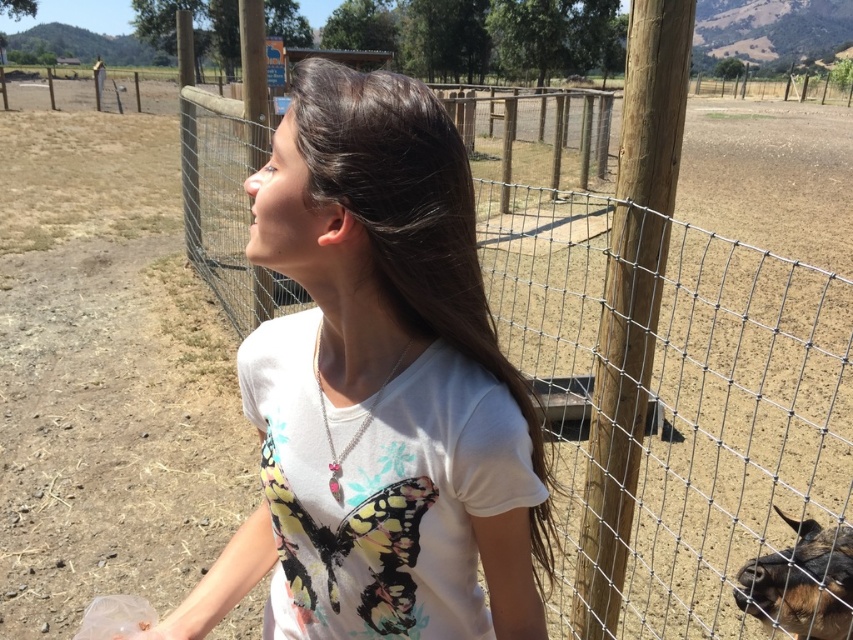
Who is more distant from viewer, (349, 544) or (802, 554)?

The point (802, 554) is more distant.

Measure the distance between white matte shirt at center and camera.

white matte shirt at center is 29.15 inches away from camera.

At what (x,y) coordinates should I click in order to perform the action: click on white matte shirt at center. Please return your answer as a coordinate pair (x, y). Looking at the image, I should click on (379, 388).